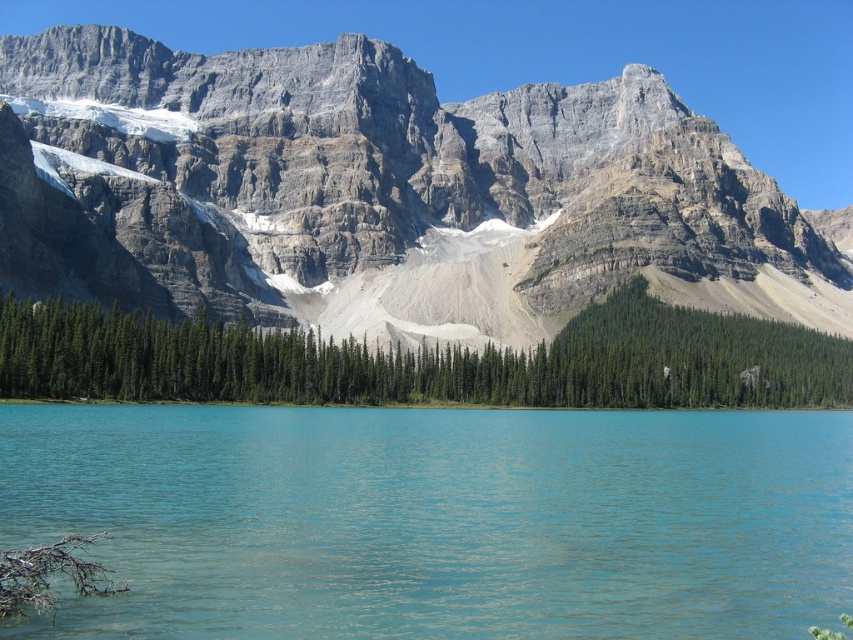
You are a hiker planning to take a photo of the rocky gray mountain at upper center and the turquoise water at center. Which object should you focus on first if you want to capture both in a single frame without adjusting your camera settings?

The rocky gray mountain at upper center is bigger than the turquoise water at center, so you should focus on the rocky gray mountain at upper center first to ensure it is in sharp focus before the smaller object.

You are a photographer planning to capture the entire scene in one shot. Given that the turquoise water at center and the green matte trees at center are both in the frame, which object would require you to adjust your camera angle to ensure it fits properly?

The green matte trees at center have a greater width than the turquoise water at center, so you would need to adjust your camera angle to accommodate their wider presence in the scene.

You are standing at the edge of the lake and want to take a photo of the turquoise water at center. If your camera has a maximum focus range of 60 meters, will it be able to capture the water clearly?

The distance between the turquoise water at center and the camera is 60.10 meters, which exceeds the camera maximum focus range of 60 meters. Therefore, the camera cannot capture the water clearly.